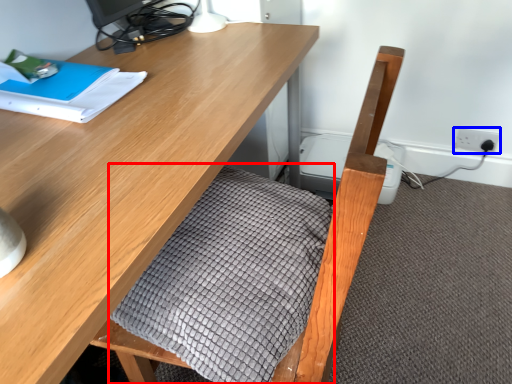
Question: Which object appears farthest to the camera in this image, blanket (highlighted by a red box) or electric outlet (highlighted by a blue box)?

Choices:
 (A) blanket
 (B) electric outlet

Answer: (B)